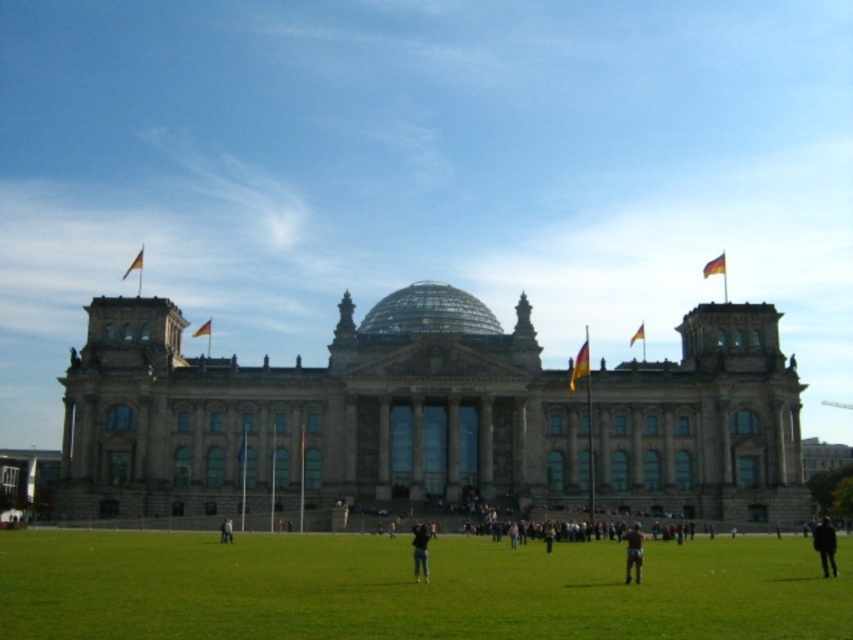
You are a photographer standing in front of the Reichstag building. You notice two people wearing pants of different shades of gray. The person in the light gray fabric pants at lower center is facing the building, while the other in the dark gray pants at lower right is turned away. If you want to capture both individuals in a single frame without moving your camera, which person is positioned farther to the right?

The dark gray pants at lower right are to the right of the light gray fabric pants at lower center, so the person in the dark gray pants at lower right is farther to the right.